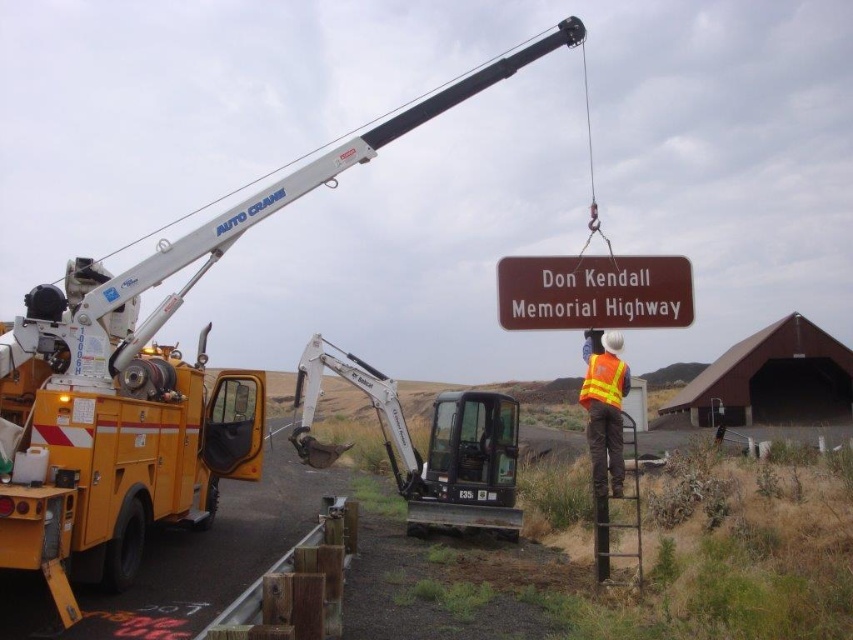
Question: Which of the following is the farthest from the observer?

Choices:
 (A) (635, 307)
 (B) (590, 445)
 (C) (585, 392)
 (D) (457, 497)

Answer: (D)

Question: Is gray metallic excavator at center thinner than brownmaterial/texturesign at center?

Choices:
 (A) no
 (B) yes

Answer: (A)

Question: Among these objects, which one is nearest to the camera?

Choices:
 (A) reflective orange vest at center
 (B) brownmaterial/texturesign at center
 (C) gray metallic excavator at center

Answer: (A)

Question: Can you confirm if reflective orange vest at center is smaller than reflective orange safety vest at center?

Choices:
 (A) no
 (B) yes

Answer: (A)

Question: Can you confirm if gray metallic excavator at center is positioned below reflective orange vest at center?

Choices:
 (A) yes
 (B) no

Answer: (A)

Question: Which point is closer to the camera taking this photo?

Choices:
 (A) (595, 355)
 (B) (515, 410)

Answer: (A)